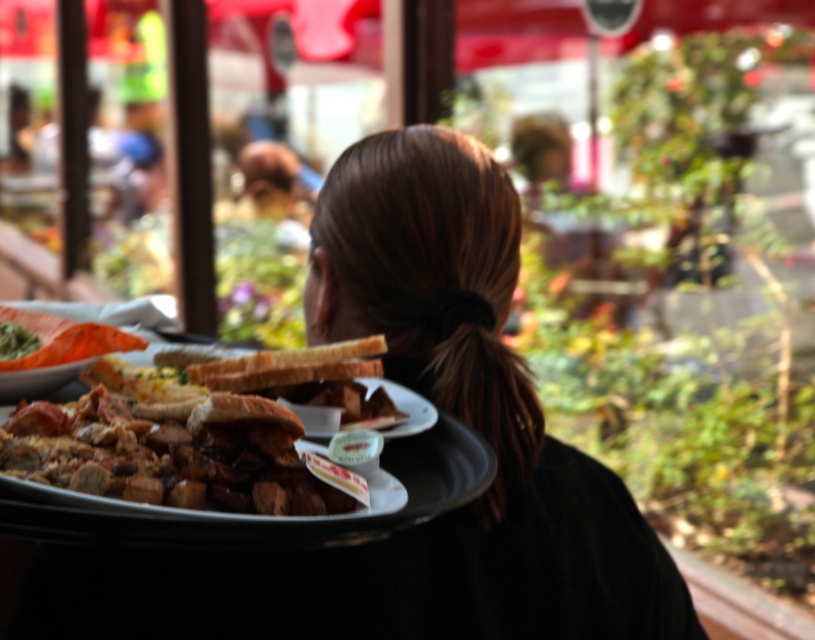
You are a photographer trying to capture the person from behind at an outdoor cafe. The person has brown hair at center. To ensure the focus is on their hair, where should you aim the camera? Use the coordinates provided in the description.

The brown hair at center is located at point (472,413), so aim the camera at those coordinates to focus on the hair.

You are a food delivery person who needs to deliver a meal to the customer at the table with the golden brown bread at center. The coordinates given are in the format of normalized coordinates between 0 and 1. The golden brown bread at center is located at point (166, 445). Which object on the tray should you prioritize delivering first based on its position relative to the golden brown bread at center?

The golden brown bread at center is located at point (166, 445), so you should prioritize delivering the golden brown bread at center first as it is the central item on the tray.

You are a food delivery person who needs to place a hot meal on the tray. The golden brown bread at center and orange matte plate at upper left are on the tray. Can you fit a 5 inch wide container between them without moving the existing items?

The golden brown bread at center and orange matte plate at upper left are 5.14 inches apart from each other. Since the container is 5 inches wide, it can fit between them as there is enough space.